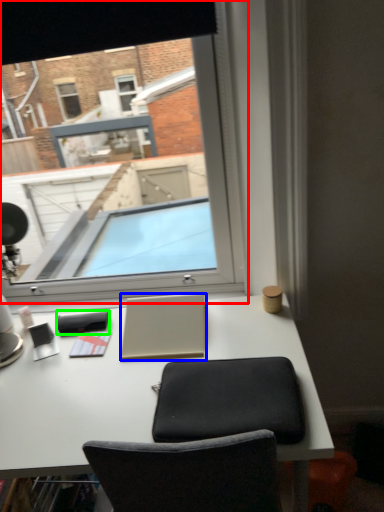
Question: Estimate the real-world distances between objects in this image. Which object is farther from window (highlighted by a red box), laptop (highlighted by a blue box) or notepad (highlighted by a green box)?

Choices:
 (A) laptop
 (B) notepad

Answer: (B)